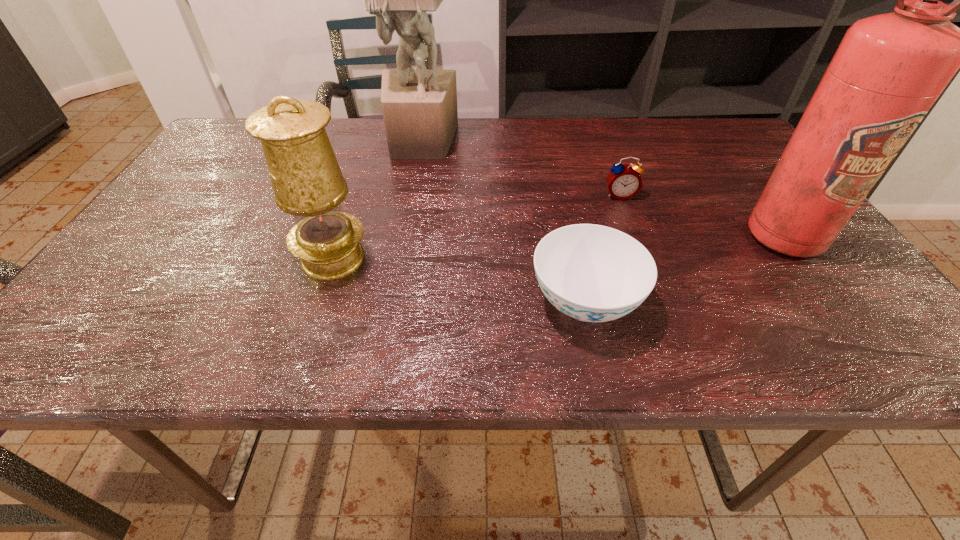
Locate an element on the screen. The height and width of the screenshot is (540, 960). object positioned at the far edge is located at coordinates (419, 106).

You are a GUI agent. You are given a task and a screenshot of the screen. Output one action in this format:
    pyautogui.click(x=<x>, y=<y>)
    Task: Click on the object situated at the near edge
    Image resolution: width=960 pixels, height=540 pixels.
    Given the screenshot: What is the action you would take?
    pyautogui.click(x=592, y=273)

This screenshot has width=960, height=540. Find the location of `object located in the right edge section of the desktop`. object located in the right edge section of the desktop is located at coordinates pyautogui.click(x=889, y=69).

Locate an element on the screen. This screenshot has width=960, height=540. vacant space at the far edge of the desktop is located at coordinates (340, 154).

This screenshot has height=540, width=960. Identify the location of free space at the near edge of the desktop. (402, 346).

The width and height of the screenshot is (960, 540). Identify the location of vacant space at the left edge of the desktop. (116, 294).

The height and width of the screenshot is (540, 960). I want to click on free space at the right edge of the desktop, so click(x=839, y=256).

Image resolution: width=960 pixels, height=540 pixels. What are the coordinates of `vacant space at the far left corner` in the screenshot? It's located at (239, 144).

The width and height of the screenshot is (960, 540). In the image, there is a desktop. What are the coordinates of `vacant region at the far right corner` in the screenshot? It's located at (707, 125).

Locate an element on the screen. Image resolution: width=960 pixels, height=540 pixels. vacant area at the near right corner of the desktop is located at coordinates (828, 327).